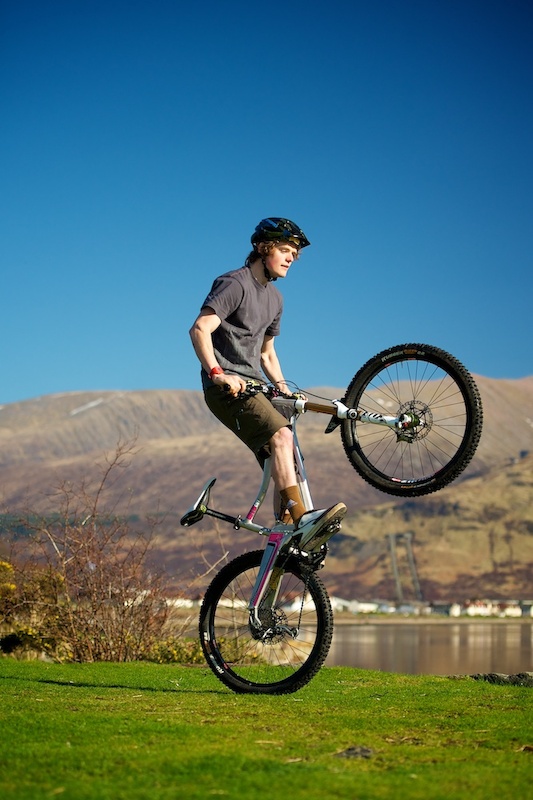
Where is `seat`? seat is located at coordinates (199, 513).